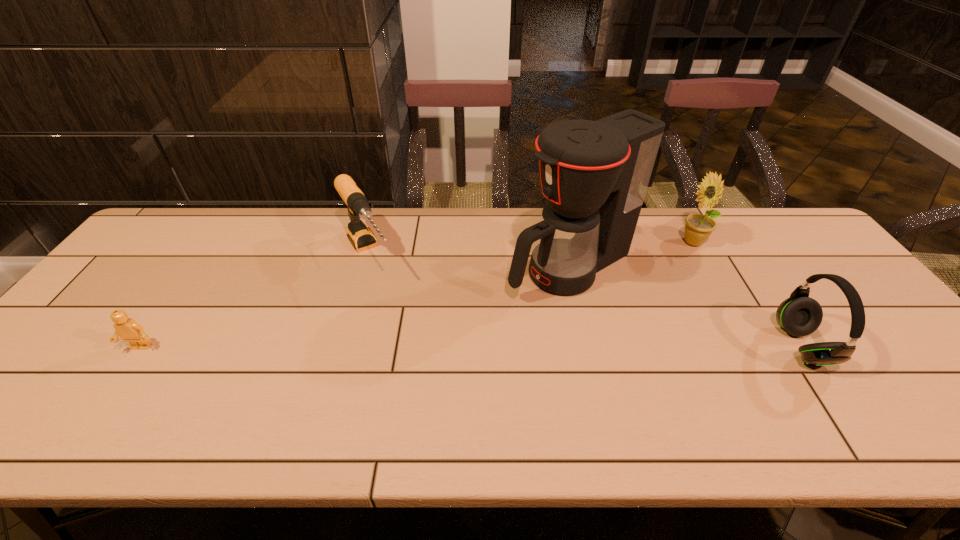
In order to click on drill that is positioned at the far edge in this screenshot , I will do `click(361, 237)`.

Locate an element on the screen. The image size is (960, 540). object at the near edge is located at coordinates (799, 315).

In the image, there is a desktop. Where is `blank space at the far edge`? The height and width of the screenshot is (540, 960). blank space at the far edge is located at coordinates (526, 213).

Locate an element on the screen. This screenshot has height=540, width=960. vacant space at the near edge is located at coordinates (586, 398).

The height and width of the screenshot is (540, 960). In order to click on free location at the left edge of the desktop in this screenshot , I will do `click(168, 279)`.

You are a GUI agent. You are given a task and a screenshot of the screen. Output one action in this format:
    pyautogui.click(x=<x>, y=<y>)
    Task: Click on the blank space at the right edge of the desktop
    Image resolution: width=960 pixels, height=540 pixels.
    Given the screenshot: What is the action you would take?
    pyautogui.click(x=800, y=279)

You are a GUI agent. You are given a task and a screenshot of the screen. Output one action in this format:
    pyautogui.click(x=<x>, y=<y>)
    Task: Click on the blank area at the far left corner
    This screenshot has width=960, height=540.
    Given the screenshot: What is the action you would take?
    pyautogui.click(x=199, y=220)

Find the location of a particular element. vacant point at the far right corner is located at coordinates [756, 223].

The height and width of the screenshot is (540, 960). I want to click on free point between the leftmost object and the rightmost object, so click(x=471, y=347).

The width and height of the screenshot is (960, 540). What are the coordinates of `free spot between the coffee maker and the sunflower` in the screenshot? It's located at (632, 255).